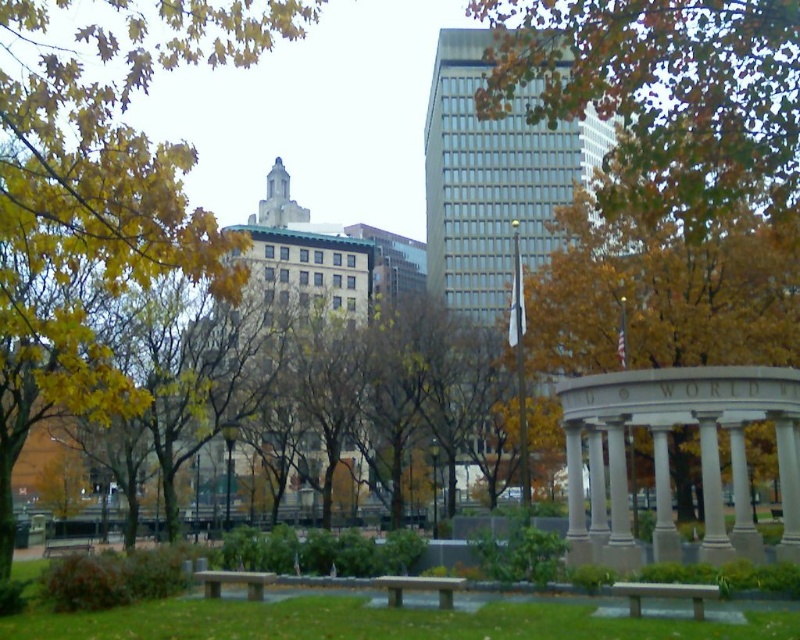
Who is lower down, smooth concrete bench at lower center or wooden bench at center?

Positioned lower is wooden bench at center.

Does smooth concrete bench at lower center appear on the right side of wooden bench at center?

Yes, smooth concrete bench at lower center is to the right of wooden bench at center.

The height and width of the screenshot is (640, 800). In order to click on smooth concrete bench at lower center in this screenshot , I will do `click(666, 595)`.

Identify the location of smooth concrete bench at lower center. (666, 595).

Is white marble gazebo at center thinner than stone bench at center?

Correct, white marble gazebo at center's width is less than stone bench at center's.

Is point (616, 426) behind point (380, 582)?

Yes, it is.

The width and height of the screenshot is (800, 640). Find the location of `white marble gazebo at center`. white marble gazebo at center is located at coordinates (668, 456).

In the scene shown: Does yellow leafy tree at center have a smaller size compared to wooden bench at lower left?

Actually, yellow leafy tree at center might be larger than wooden bench at lower left.

Is yellow leafy tree at center wider than wooden bench at lower left?

Yes.

Find the location of a particular element. This screenshot has width=800, height=640. yellow leafy tree at center is located at coordinates (662, 288).